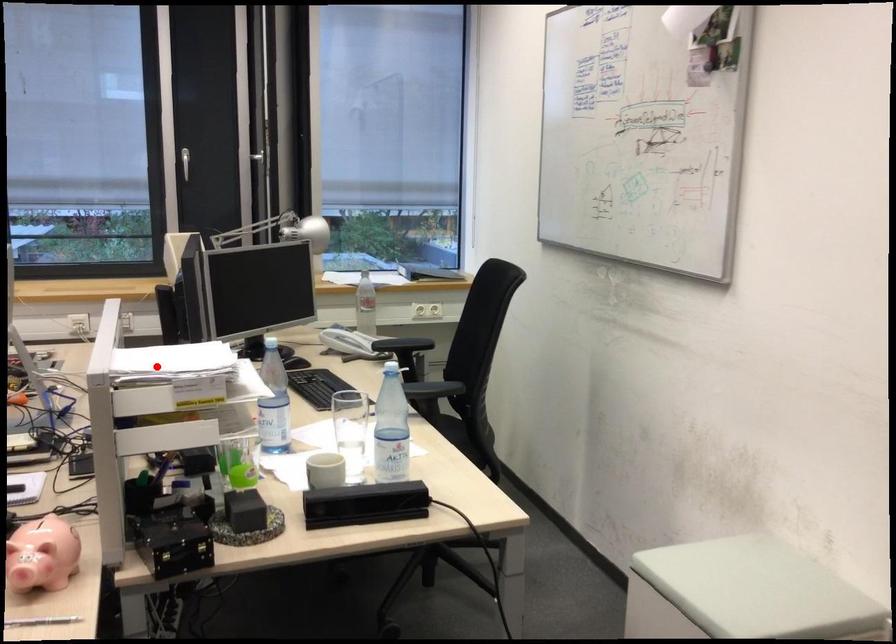
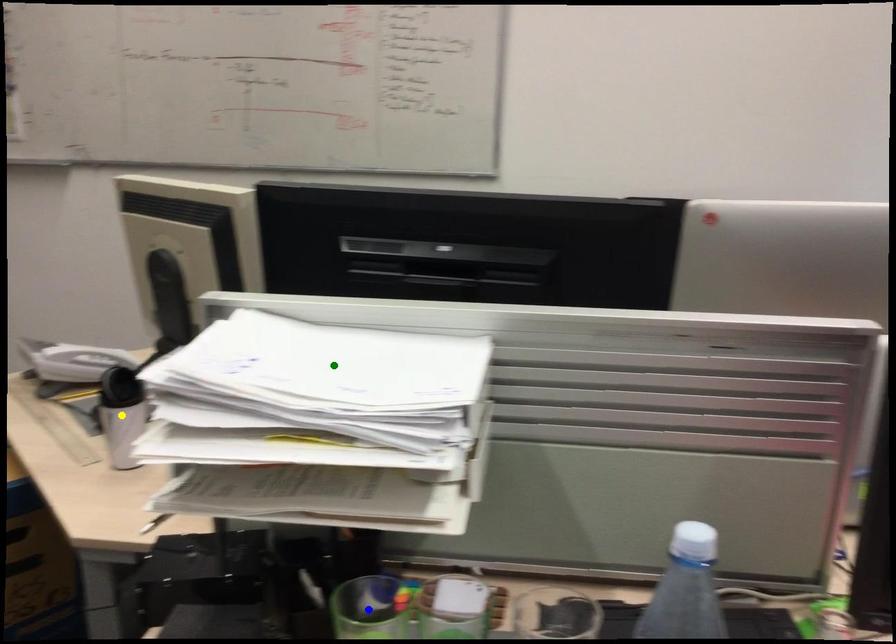
Question: I am providing you with two images of the same scene from different viewpoints. A red point is marked on the first image. You are given multiple points on the second image. Which spot in image 2 lines up with the point in image 1?

Choices:
 (A) blue point
 (B) yellow point
 (C) green point

Answer: (C)